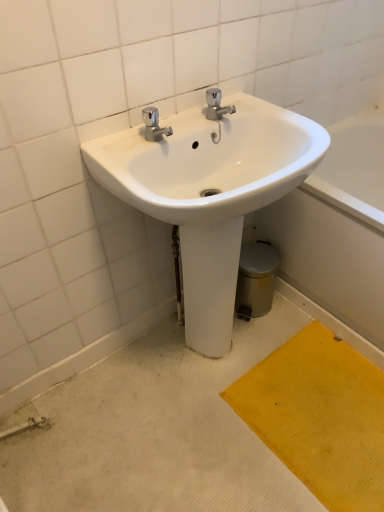
Where is `free space that is to the left of yellow textured mat at lower right`? This screenshot has width=384, height=512. free space that is to the left of yellow textured mat at lower right is located at coordinates (186, 443).